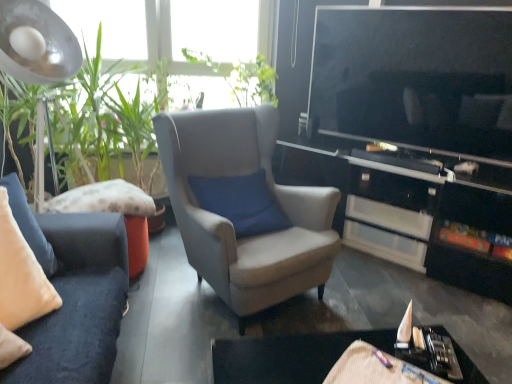
The height and width of the screenshot is (384, 512). Find the location of `free location above black glossy table at lower right (from a real-world perspective)`. free location above black glossy table at lower right (from a real-world perspective) is located at coordinates [337, 357].